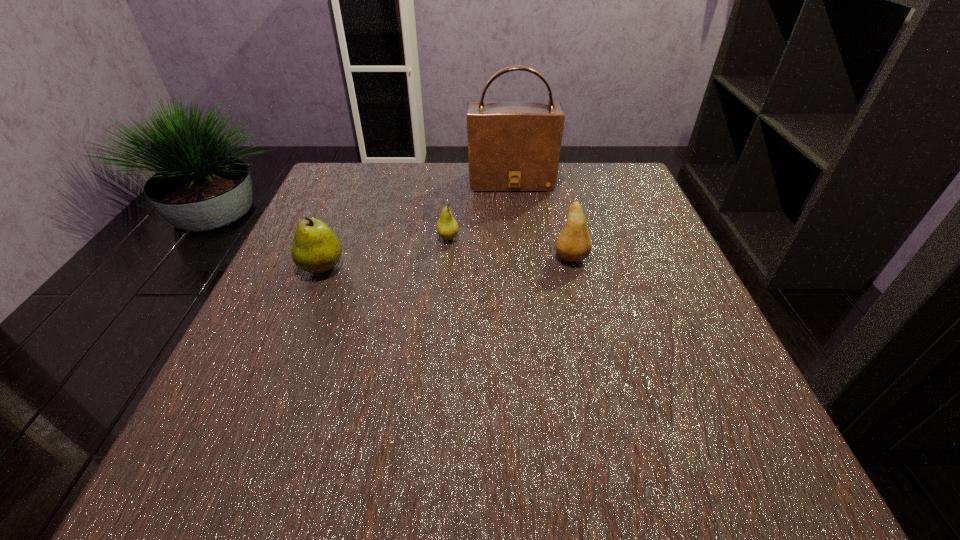
You are a GUI agent. You are given a task and a screenshot of the screen. Output one action in this format:
    pyautogui.click(x=<x>, y=<y>)
    Task: Click on the object that is the second nearest to the tallest object
    
    Given the screenshot: What is the action you would take?
    pyautogui.click(x=573, y=244)

What are the coordinates of `pear object that ranks as the second closest to the tallest object` in the screenshot? It's located at pyautogui.click(x=573, y=244).

I want to click on pear that is the second closest to the third object from right to left, so click(x=573, y=244).

You are a GUI agent. You are given a task and a screenshot of the screen. Output one action in this format:
    pyautogui.click(x=<x>, y=<y>)
    Task: Click on the vacant space that satisfies the following two spatial constraints: 1. on the front flap of the farthest object; 2. on the right side of the rightmost pear
    The width and height of the screenshot is (960, 540).
    Given the screenshot: What is the action you would take?
    pos(519,258)

Locate an element on the screen. This screenshot has width=960, height=540. vacant area that satisfies the following two spatial constraints: 1. on the front flap of the shoulder bag; 2. on the right side of the rightmost pear is located at coordinates (519, 258).

Find the location of a particular element. vacant space that satisfies the following two spatial constraints: 1. on the front flap of the rightmost pear; 2. on the right side of the tallest object is located at coordinates (519, 258).